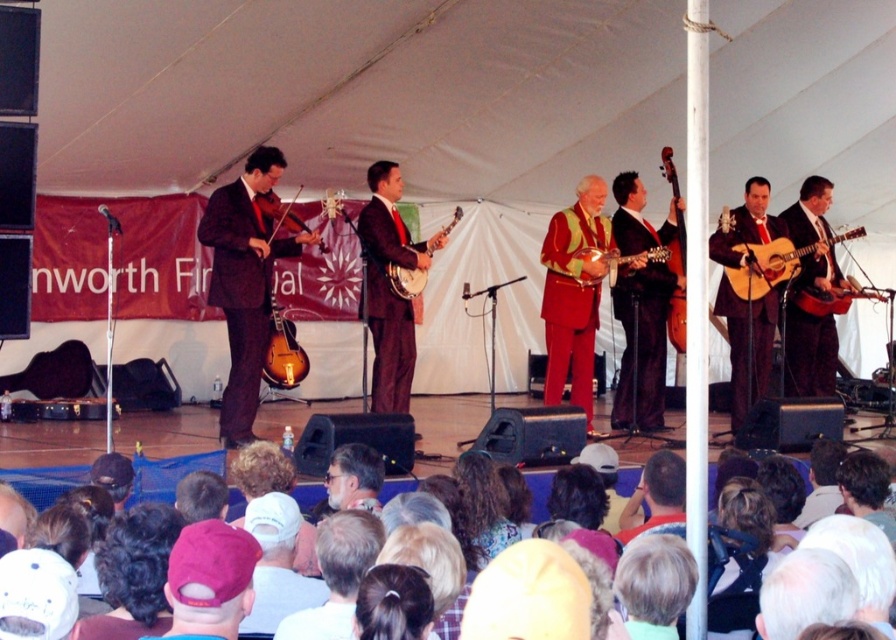
Question: Is the position of matte brown violin at left less distant than that of matte brown guitar at center?

Choices:
 (A) no
 (B) yes

Answer: (B)

Question: Which point is farther from the camera taking this photo?

Choices:
 (A) (405, 364)
 (B) (389, 266)

Answer: (A)

Question: Which point is closer to the camera taking this photo?

Choices:
 (A) (595, 282)
 (B) (645, 378)

Answer: (A)

Question: Is acoustic wood guitar at center right smaller than brown wooden bass at right?

Choices:
 (A) no
 (B) yes

Answer: (A)

Question: Among these objects, which one is nearest to the camera?

Choices:
 (A) matte brown violin at left
 (B) matte wood banjo at center
 (C) acoustic wood guitar at center right

Answer: (A)

Question: Considering the relative positions of matte brown violin at left and acoustic wood guitar at center right in the image provided, where is matte brown violin at left located with respect to acoustic wood guitar at center right?

Choices:
 (A) above
 (B) below

Answer: (B)